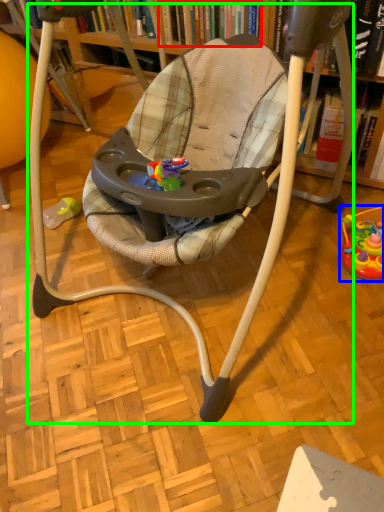
Question: Based on their relative distances, which object is farther from book (highlighted by a red box)? Choose from toy (highlighted by a blue box) and baby carriage (highlighted by a green box).

Choices:
 (A) toy
 (B) baby carriage

Answer: (A)